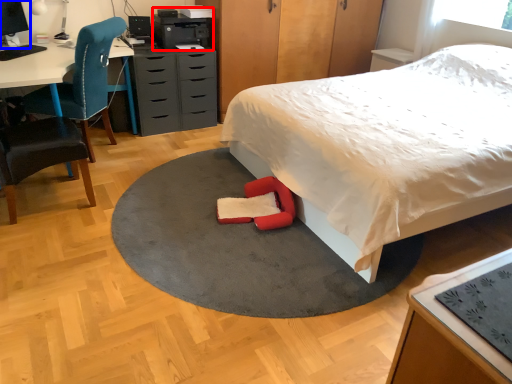
Question: Which point is closer to the camera, printer (highlighted by a red box) or computer monitor (highlighted by a blue box)?

Choices:
 (A) printer
 (B) computer monitor

Answer: (B)